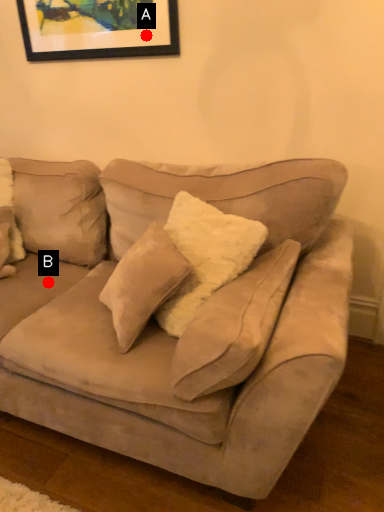
Question: Two points are circled on the image, labeled by A and B beside each circle. Which point is closer to the camera?

Choices:
 (A) A is closer
 (B) B is closer

Answer: (B)